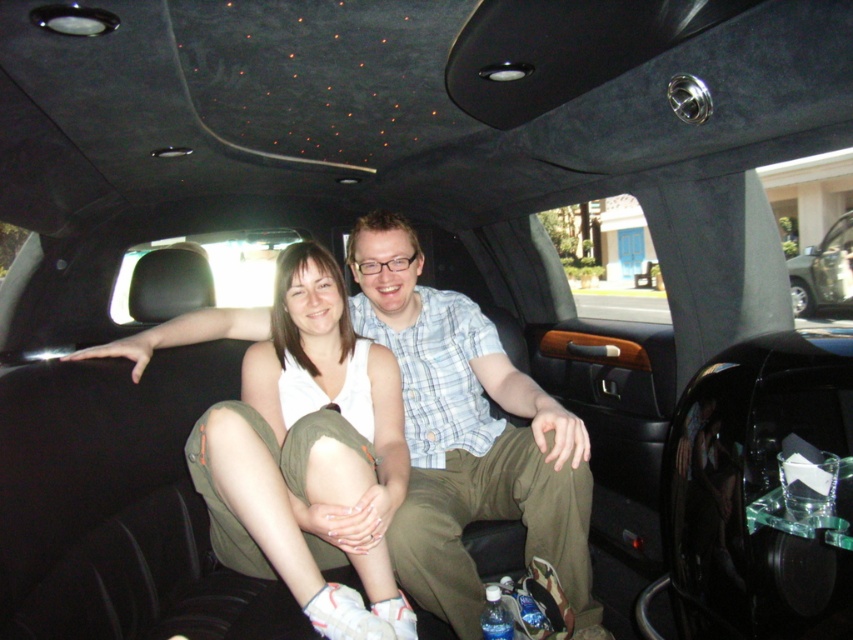
Who is higher up, light blue plaid shirt at center or white fabric shorts at center?

light blue plaid shirt at center is higher up.

Which of these two, light blue plaid shirt at center or white fabric shorts at center, stands shorter?

With less height is white fabric shorts at center.

Is point (490, 460) behind point (352, 362)?

Yes.

Image resolution: width=853 pixels, height=640 pixels. Identify the location of light blue plaid shirt at center. (467, 435).

Does matte white tank top at center lie in front of white fabric shorts at center?

No, matte white tank top at center is behind white fabric shorts at center.

From the picture: Is matte white tank top at center taller than white fabric shorts at center?

Indeed, matte white tank top at center has a greater height compared to white fabric shorts at center.

Is point (366, 288) less distant than point (305, 611)?

No, (366, 288) is behind (305, 611).

Locate an element on the screen. The width and height of the screenshot is (853, 640). matte white tank top at center is located at coordinates (467, 435).

Between point (323, 563) and point (801, 310), which one is positioned behind?

Positioned behind is point (801, 310).

Which is more to the right, white fabric shorts at center or metallic silver car at center?

metallic silver car at center is more to the right.

Where is `white fabric shorts at center`? white fabric shorts at center is located at coordinates (308, 451).